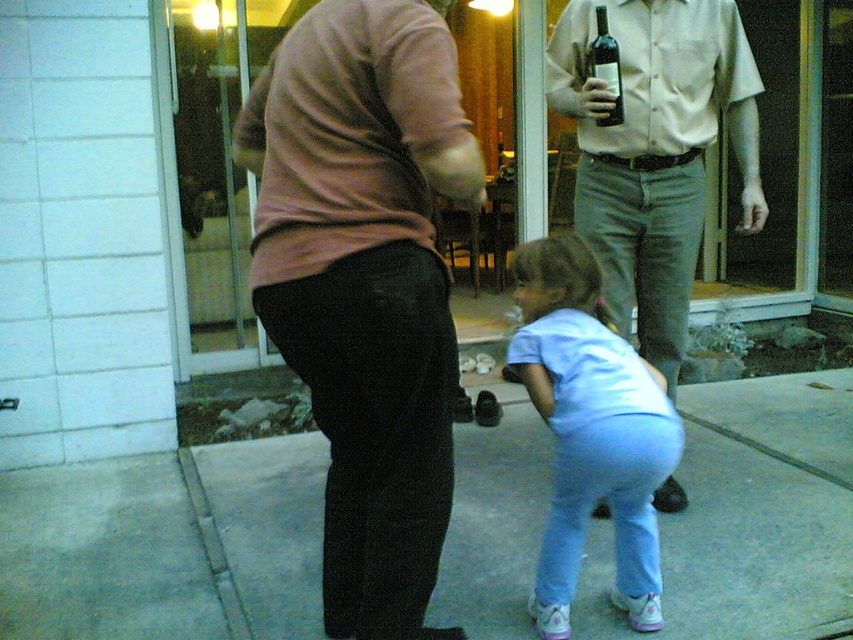
Question: Can you confirm if light beige shirt at upper right is positioned to the left of white cotton shirt at upper right?

Choices:
 (A) yes
 (B) no

Answer: (B)

Question: Which object appears farthest from the camera in this image?

Choices:
 (A) matte pink sweater at center
 (B) white cotton shirt at upper right
 (C) light beige shirt at upper right
 (D) transparent glass door at upper center

Answer: (D)

Question: Is light blue fabric pants at lower center thinner than dark glass bottle at upper center?

Choices:
 (A) no
 (B) yes

Answer: (A)

Question: Based on their relative distances, which object is nearer to the white cotton shirt at upper right?

Choices:
 (A) light gray concrete at lower center
 (B) pink matte shirt at center

Answer: (B)

Question: Which of the following is the farthest from the observer?

Choices:
 (A) (590, 282)
 (B) (596, 33)

Answer: (B)

Question: Is light blue fabric pants at lower center further to camera compared to transparent glass door at upper center?

Choices:
 (A) no
 (B) yes

Answer: (A)